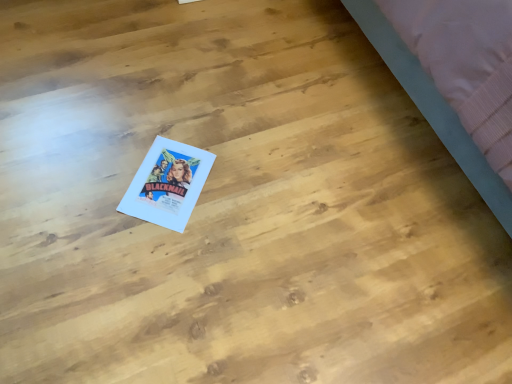
The image size is (512, 384). What do you see at coordinates (167, 184) in the screenshot?
I see `white paper at center` at bounding box center [167, 184].

The height and width of the screenshot is (384, 512). I want to click on white paper at center, so click(167, 184).

Measure the distance between white paper at center and camera.

4.15 feet.

At what (x,y) coordinates should I click in order to perform the action: click on white paper at center. Please return your answer as a coordinate pair (x, y). Looking at the image, I should click on [x=167, y=184].